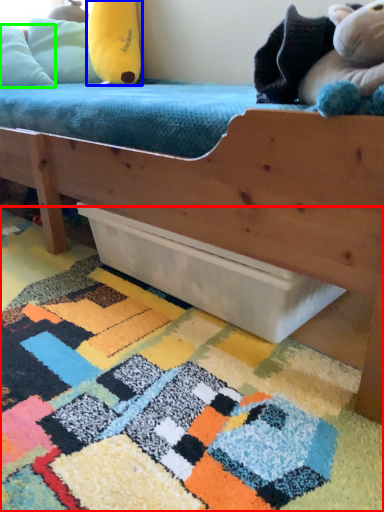
Question: Which object is the farthest from mat (highlighted by a red box)? Choose among these: toy (highlighted by a blue box) or pillow (highlighted by a green box).

Choices:
 (A) toy
 (B) pillow

Answer: (A)